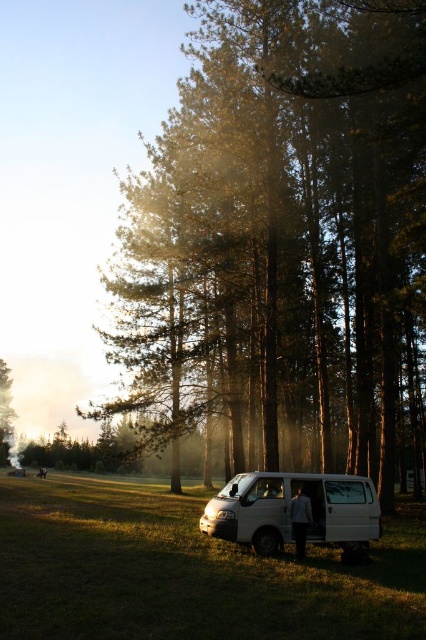
The height and width of the screenshot is (640, 426). What do you see at coordinates (293, 225) in the screenshot?
I see `green textured pine trees at center` at bounding box center [293, 225].

Does green textured pine trees at center appear on the right side of white matte van at center?

In fact, green textured pine trees at center is to the left of white matte van at center.

Is point (270, 364) in front of point (345, 556)?

No.

This screenshot has height=640, width=426. In order to click on green textured pine trees at center in this screenshot , I will do `click(293, 225)`.